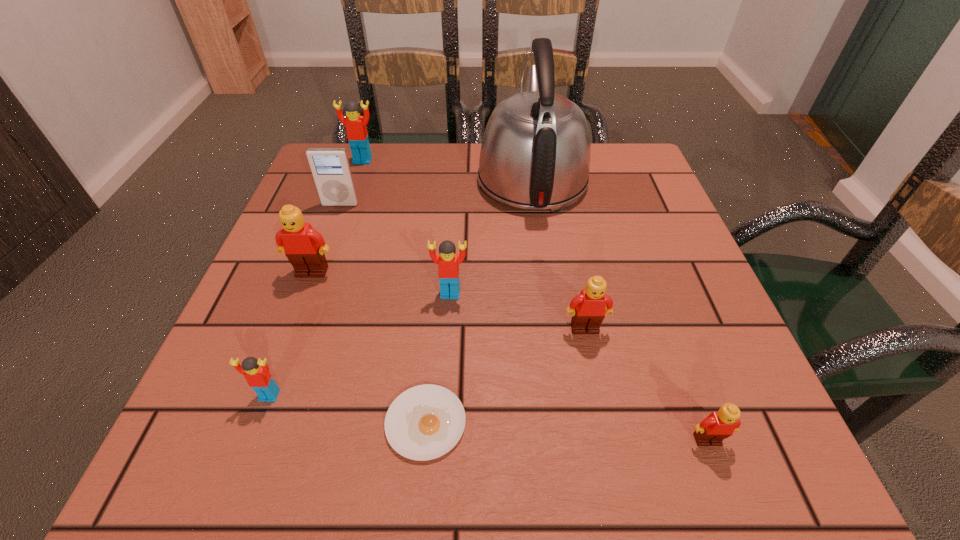
The image size is (960, 540). What are the coordinates of `Lego that is the fifth nearest to the rightmost brown Lego` in the screenshot? It's located at (357, 135).

This screenshot has width=960, height=540. What are the coordinates of `Lego that is the third closest to the sixth nearest object` in the screenshot? It's located at (357, 135).

Locate an element on the screen. The width and height of the screenshot is (960, 540). red Lego that is the second closest to the farthest red Lego is located at coordinates (256, 372).

Locate an element on the screen. the second closest red Lego to the farthest Lego is located at coordinates (256, 372).

Locate which brown Lego is the closest to the nearest red Lego. Please provide its 2D coordinates. Your answer should be formatted as a tuple, i.e. [(x, y)], where the tuple contains the x and y coordinates of a point satisfying the conditions above.

[(304, 247)]

At what (x,y) coordinates should I click in order to perform the action: click on brown Lego identified as the second closest to the second nearest red Lego. Please return your answer as a coordinate pair (x, y). The height and width of the screenshot is (540, 960). Looking at the image, I should click on (304, 247).

Identify the location of vacant point that satisfies the following two spatial constraints: 1. on the face of the white egg yolk; 2. on the right side of the second nearest Lego. (259, 422).

I want to click on vacant region that satisfies the following two spatial constraints: 1. on the face of the egg yolk; 2. on the left side of the second farthest Lego, so click(x=256, y=422).

Locate an element on the screen. The height and width of the screenshot is (540, 960). free space in the image that satisfies the following two spatial constraints: 1. on the face of the egg yolk; 2. on the right side of the farthest red Lego is located at coordinates (273, 422).